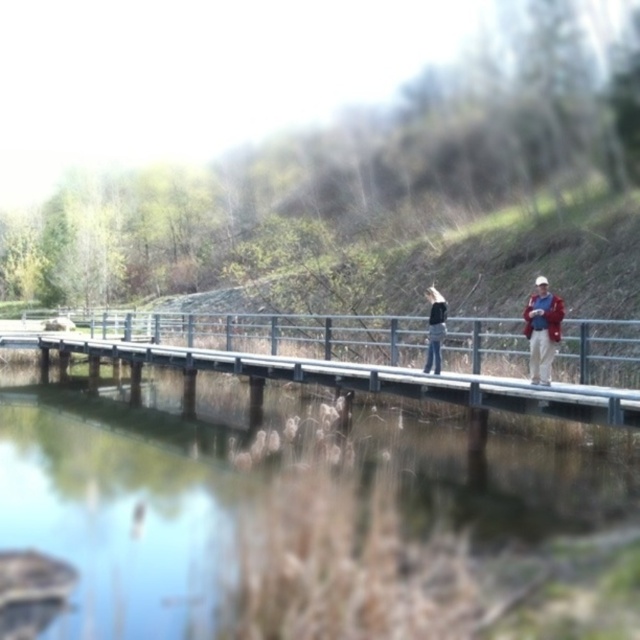
You are standing on the wooden bridge and want to cross to the other side. There is a point marked at coordinates (305,518) on the bridge. What is located at this point?

The point at coordinates (305,518) on the bridge marks the location of clear water at bridge center.

You are standing on the wooden bridge and want to locate the clear water at bridge center. According to the coordinates provided, where should you look?

The clear water at bridge center is located at the coordinates point (305, 518).

Looking at this image, you are standing on the wooden bridge and want to cross to the other side. You notice the clear water at bridge center and the red jacket at right. Which object is higher from the ground level?

The clear water at bridge center is much taller than the red jacket at right, so the clear water at bridge center is higher from the ground level.